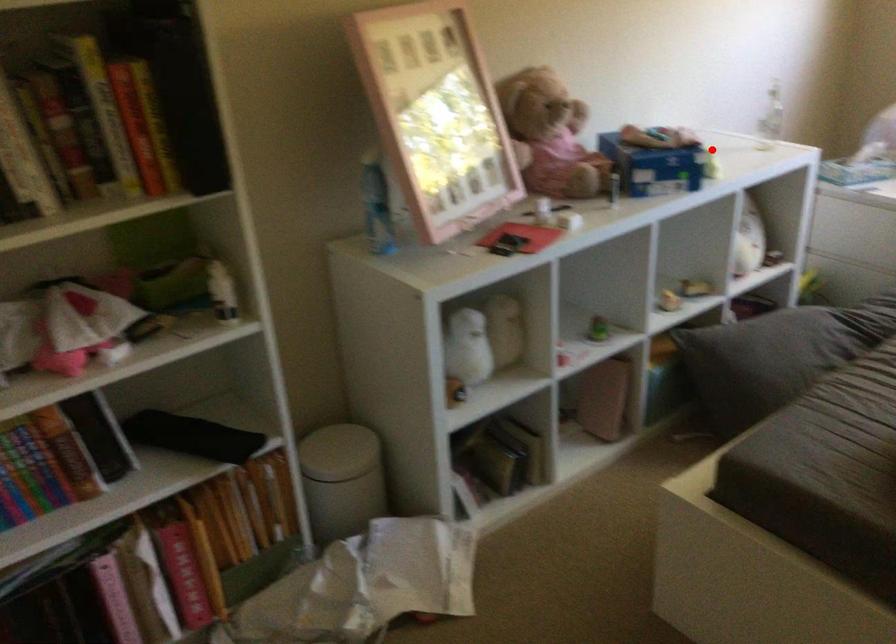
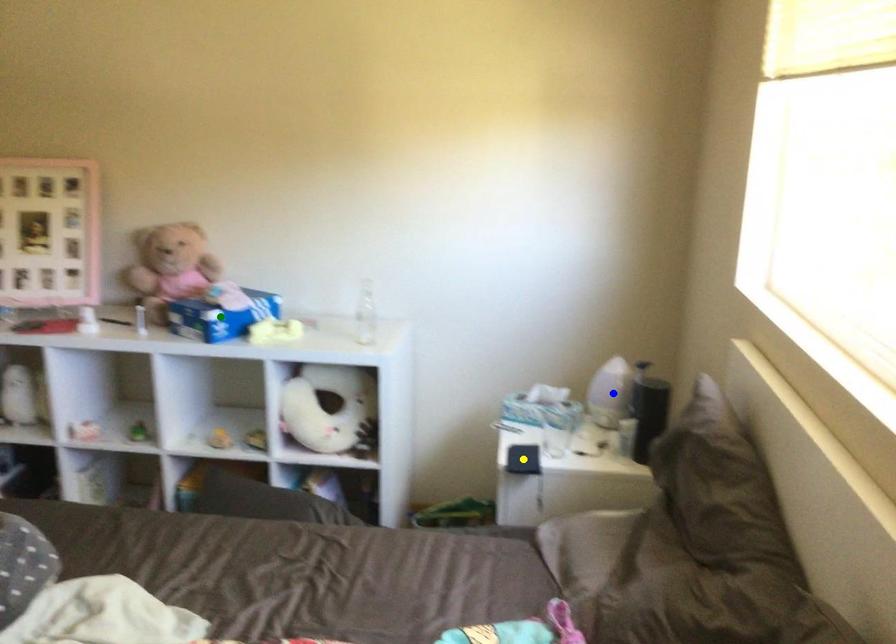
Question: I am providing you with two images of the same scene from different viewpoints. A red point is marked on the first image. You are given multiple points on the second image. Can you choose the point in image 2 that corresponds to the point in image 1?

Choices:
 (A) yellow point
 (B) blue point
 (C) green point

Answer: (C)